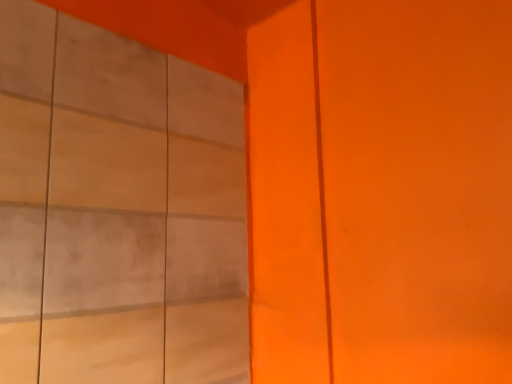
The width and height of the screenshot is (512, 384). What do you see at coordinates (117, 209) in the screenshot?
I see `matte wood window at left` at bounding box center [117, 209].

Measure the distance between matte wood window at left and camera.

34.98 inches.

You are a GUI agent. You are given a task and a screenshot of the screen. Output one action in this format:
    pyautogui.click(x=<x>, y=<y>)
    Task: Click on the matte wood window at left
    Image resolution: width=512 pixels, height=384 pixels.
    Given the screenshot: What is the action you would take?
    pyautogui.click(x=117, y=209)

This screenshot has width=512, height=384. In order to click on matte wood window at left in this screenshot , I will do `click(117, 209)`.